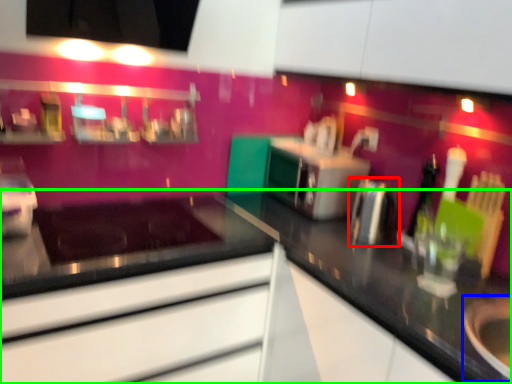
Question: Which object is positioned farthest from appliance (highlighted by a red box)? Select from appliance (highlighted by a blue box) and countertop (highlighted by a green box).

Choices:
 (A) appliance
 (B) countertop

Answer: (A)